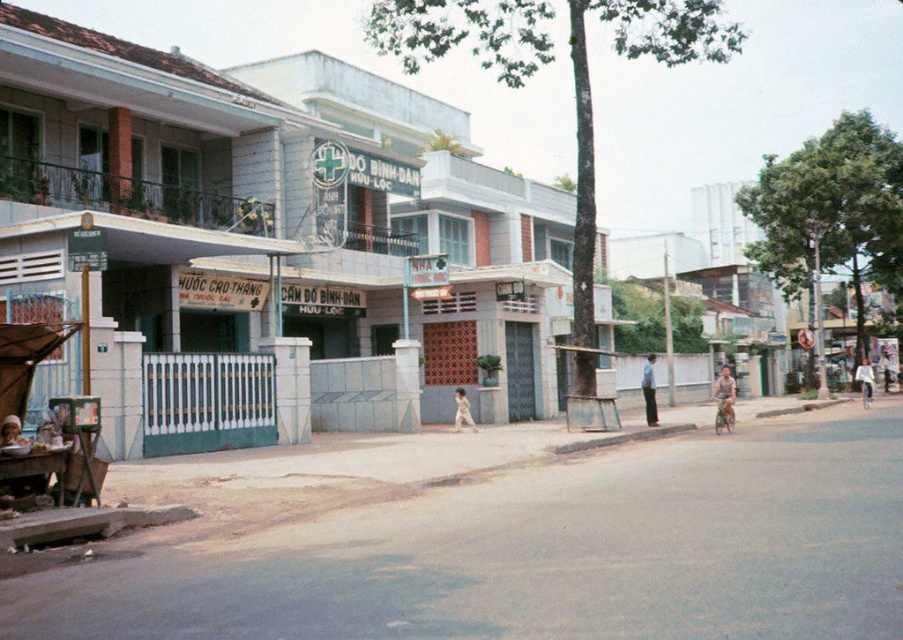
You are a photographer aiming to capture a portrait of the subject in the center of the image. The subject has a smooth skin face at center and is wearing a light blue shirt at center. Given that the face is narrower than the shirt, how should you adjust your framing to ensure both elements are clearly visible?

Since the smooth skin face at center is narrower than the light blue shirt at center, you should frame the shot so that the shirt occupies more horizontal space while still keeping the face centered and visible. This ensures both elements are captured clearly without overcrowding the composition.